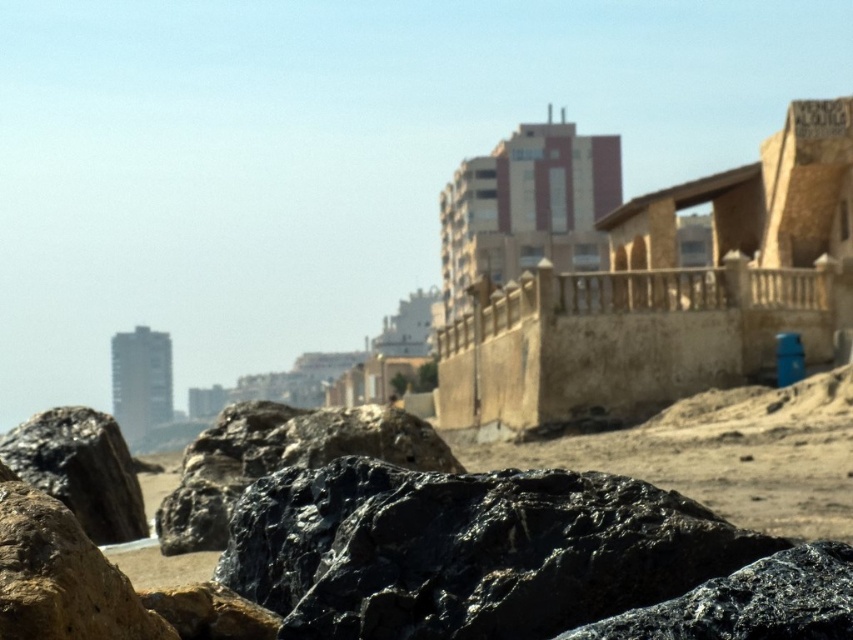
You are standing on the sandy area and want to place a small potted plant between the shiny black rock at lower left and the black rough rock at lower left. Can you fit it there?

The shiny black rock at lower left might be wider than black rough rock at lower left, so there may be enough space to fit the small potted plant between them.

You are standing on the sandy area and want to pick up the shiny black rock at lower left. Is the black rough rock at lower left blocking your direct path to it?

The shiny black rock at lower left is below the black rough rock at lower left, so the black rough rock at lower left is blocking the direct path to the shiny black rock at lower left.

You are a photographer setting up equipment on the beach. You have two rocks in your viewfinder, the shiny black rock at lower left and the black rough rock at lower left. Which rock takes up more space in your photo?

The black rough rock at lower left takes up more space in the photo because it occupies more space than the shiny black rock at lower left.